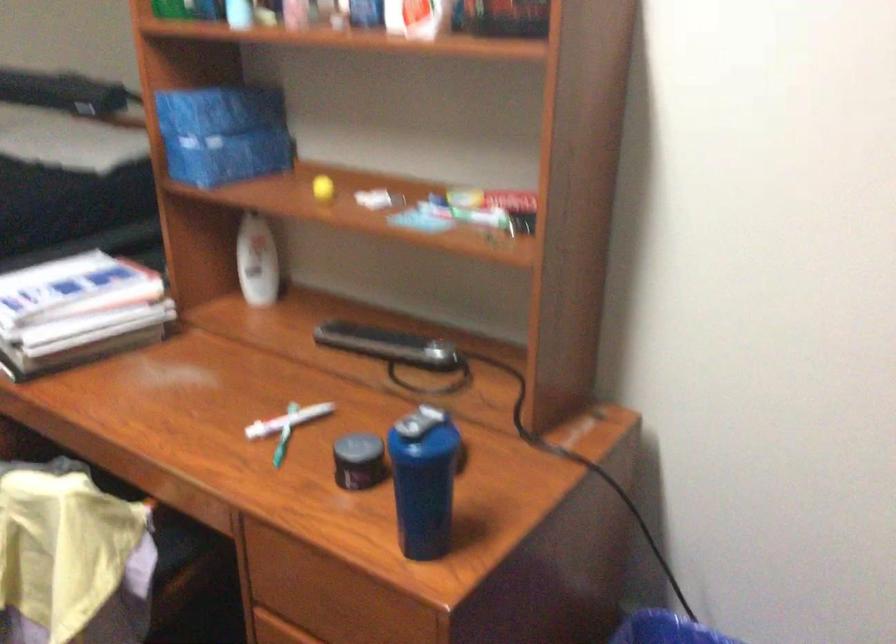
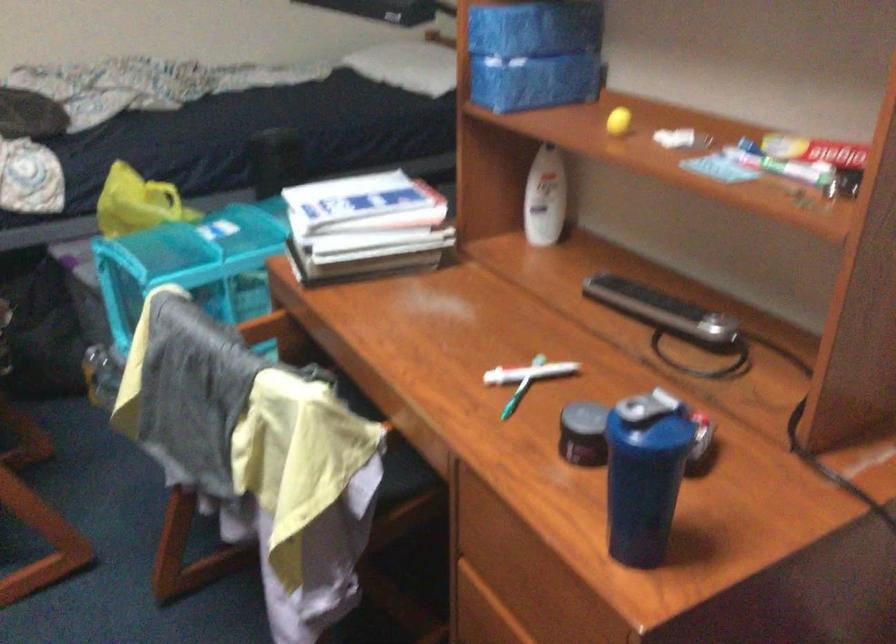
Where in the second image is the point corresponding to the point at 468,210 from the first image?

(780, 164)